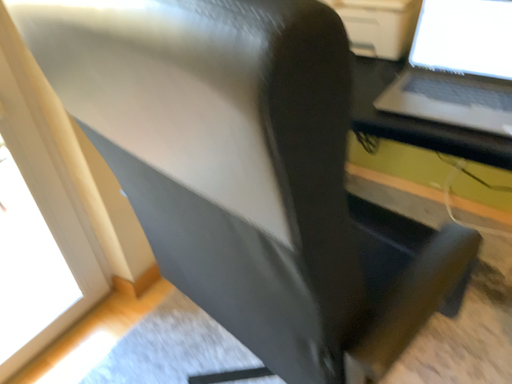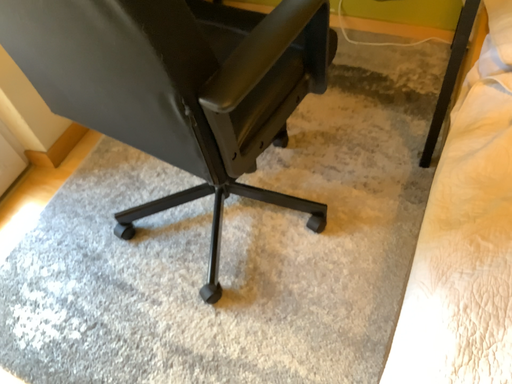
Question: How did the camera likely rotate when shooting the video?

Choices:
 (A) rotated upward
 (B) rotated downward

Answer: (B)